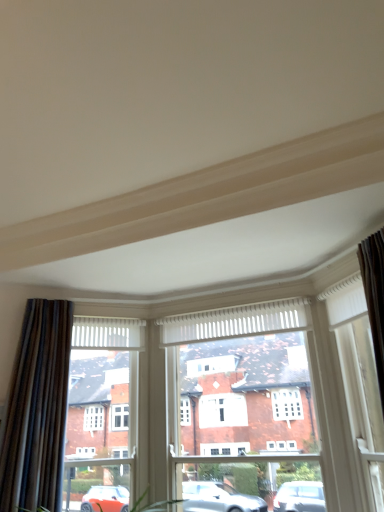
Question: In the image, is white wood window frame at center positioned in front of or behind white wood frame at right?

Choices:
 (A) front
 (B) behind

Answer: (B)

Question: From a real-world perspective, is white wood window frame at center physically located above or below white wood frame at right?

Choices:
 (A) below
 (B) above

Answer: (A)

Question: Which is nearer to the white wood window frame at center?

Choices:
 (A) dark brown textured curtain at left
 (B) white wood frame at right

Answer: (B)

Question: Which of these objects is positioned farthest from the white wood window frame at center?

Choices:
 (A) dark brown textured curtain at left
 (B) white wood frame at right

Answer: (A)